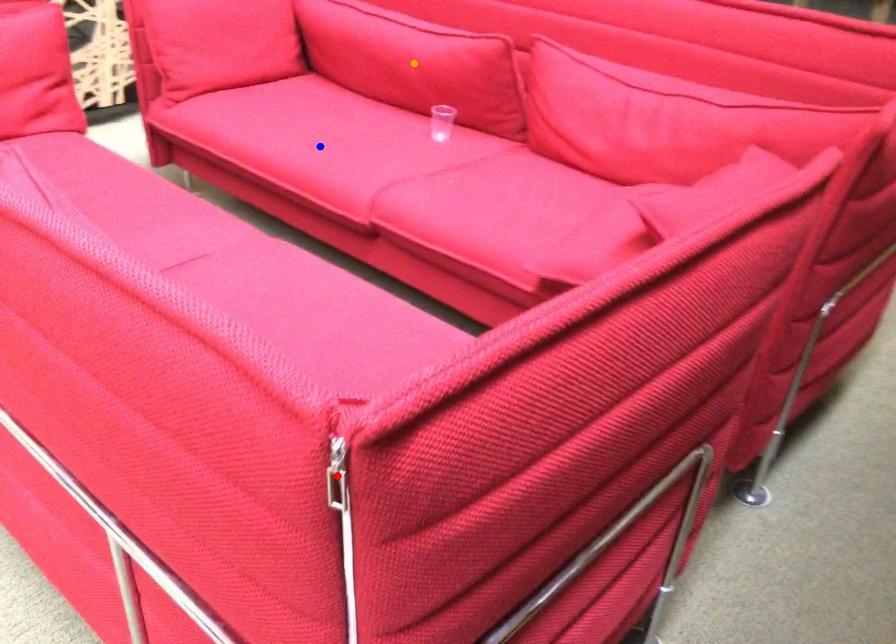
Order these from nearest to farthest:
1. red point
2. blue point
3. orange point

red point → blue point → orange point